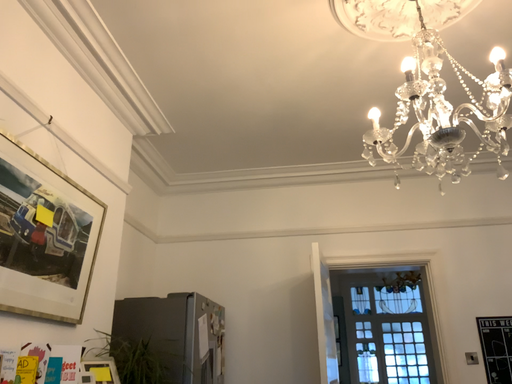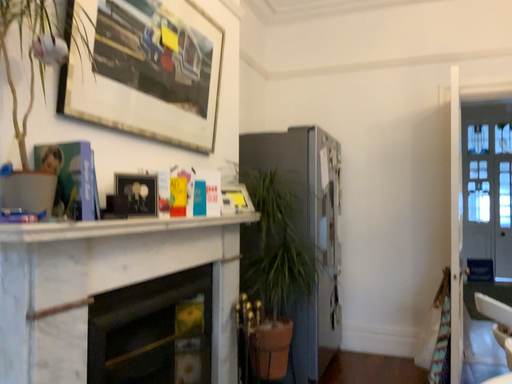
Question: How did the camera likely rotate when shooting the video?

Choices:
 (A) rotated downward
 (B) rotated upward

Answer: (A)